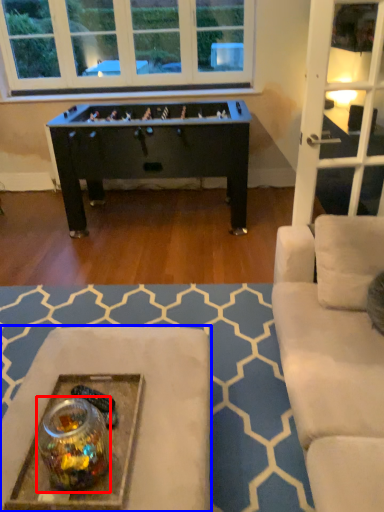
Question: Among these objects, which one is nearest to the camera, glass jar (highlighted by a red box) or table (highlighted by a blue box)?

Choices:
 (A) glass jar
 (B) table

Answer: (A)